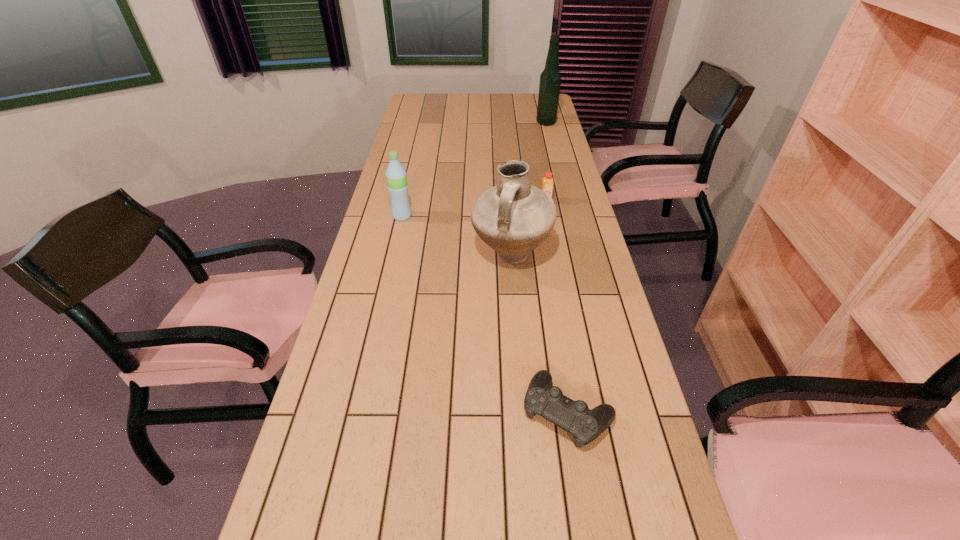
Where is `vacant region located 0.190m on the left of the farthest object`? vacant region located 0.190m on the left of the farthest object is located at coordinates (495, 123).

Identify the location of vacant space located on the handle side of the second nearest object. (522, 403).

I want to click on vacant region located 0.090m on the back of the leftmost object, so click(406, 197).

The height and width of the screenshot is (540, 960). I want to click on vacant space located 0.120m on the front and back of the orange juice, so click(x=550, y=224).

This screenshot has height=540, width=960. I want to click on free space located 0.210m on the back of the nearest object, so click(551, 310).

Where is `object positioned at the left edge`? The width and height of the screenshot is (960, 540). object positioned at the left edge is located at coordinates (396, 176).

You are a GUI agent. You are given a task and a screenshot of the screen. Output one action in this format:
    pyautogui.click(x=<x>, y=<y>)
    Task: Click on the alcohol located in the right edge section of the desktop
    This screenshot has height=540, width=960.
    Given the screenshot: What is the action you would take?
    pyautogui.click(x=550, y=79)

Identify the location of pitcher positioned at the right edge. (513, 217).

Identify the location of orange juice present at the right edge. The width and height of the screenshot is (960, 540). click(547, 186).

In order to click on control at the right edge in this screenshot , I will do `click(585, 425)`.